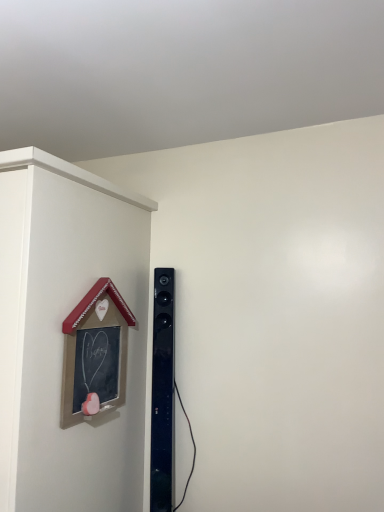
Find the location of a particular element. This screenshot has width=384, height=512. chalkboard wood at left is located at coordinates (95, 354).

The image size is (384, 512). What do you see at coordinates (95, 354) in the screenshot?
I see `chalkboard wood at left` at bounding box center [95, 354].

What is the approximate width of chalkboard wood at left?

chalkboard wood at left is 1.53 inches wide.

Where is `chalkboard wood at left`? The width and height of the screenshot is (384, 512). chalkboard wood at left is located at coordinates (95, 354).